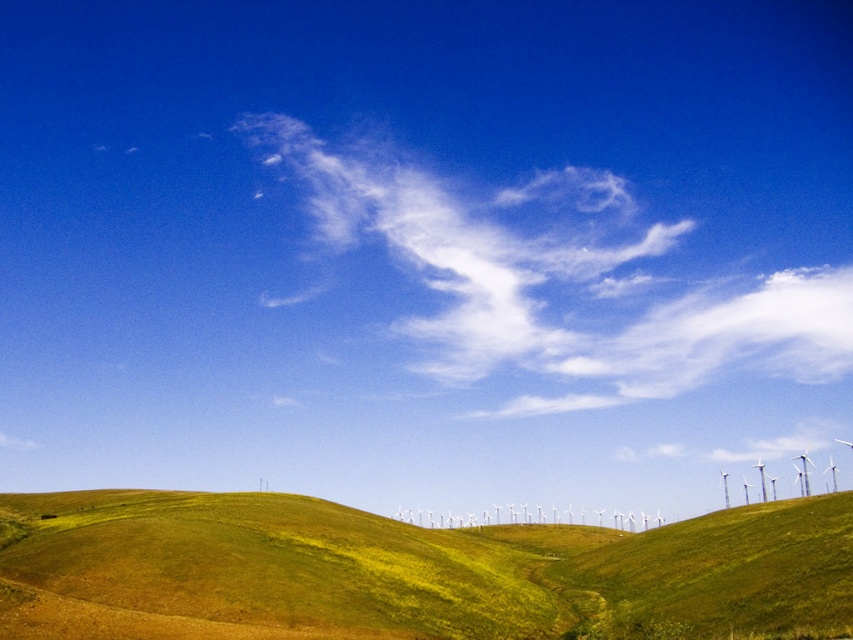
Question: Is white cotton cloud at upper center to the left of white plastic wind turbines at center from the viewer's perspective?

Choices:
 (A) no
 (B) yes

Answer: (B)

Question: Is white cotton cloud at upper center smaller than white plastic wind turbines at center?

Choices:
 (A) yes
 (B) no

Answer: (B)

Question: Which of the following is the closest to the observer?

Choices:
 (A) (566, 561)
 (B) (519, 192)
 (C) (572, 515)

Answer: (A)

Question: Does green grassy hillside at lower center have a greater width compared to white cotton cloud at upper center?

Choices:
 (A) no
 (B) yes

Answer: (A)

Question: Which of these objects is positioned closest to the white cotton cloud at upper center?

Choices:
 (A) green grassy hillside at lower center
 (B) white plastic wind turbines at center

Answer: (B)

Question: Estimate the real-world distances between objects in this image. Which object is farther from the green grassy hillside at lower center?

Choices:
 (A) white plastic wind turbines at center
 (B) white cotton cloud at upper center

Answer: (B)